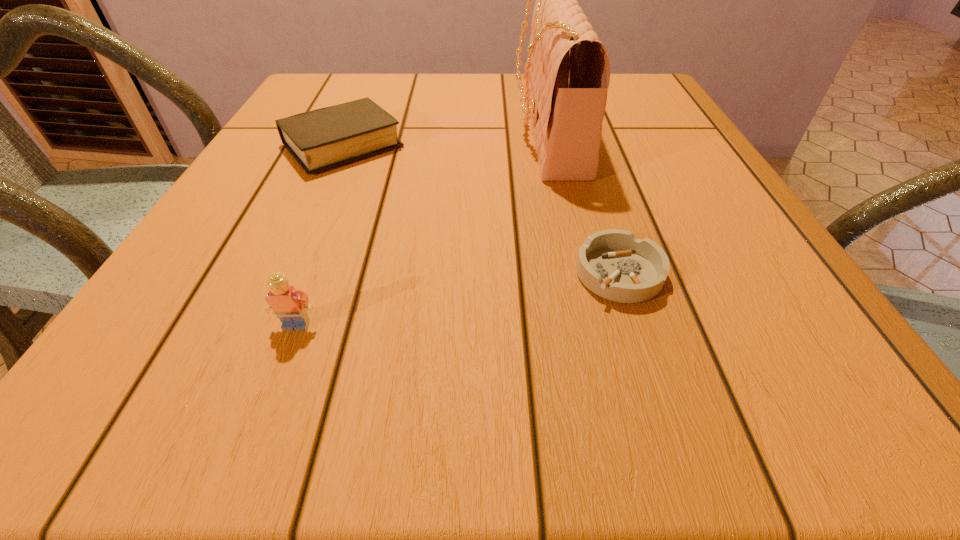
Locate which object is the second closest to the Bible. Please provide its 2D coordinates. Your answer should be formatted as a tuple, i.e. [(x, y)], where the tuple contains the x and y coordinates of a point satisfying the conditions above.

[(290, 305)]

Identify the location of free space that satisfies the following two spatial constraints: 1. on the front-facing side of the handbag; 2. on the front-facing side of the nearest object. (590, 325).

The image size is (960, 540). In order to click on vacant area that satisfies the following two spatial constraints: 1. on the front-facing side of the tallest object; 2. on the front-facing side of the Lego in this screenshot , I will do `click(590, 325)`.

Locate an element on the screen. The height and width of the screenshot is (540, 960). vacant space that satisfies the following two spatial constraints: 1. on the front-facing side of the tallest object; 2. on the back side of the shortest object is located at coordinates (579, 273).

Find the location of a particular element. free space that satisfies the following two spatial constraints: 1. on the front-facing side of the second nearest object; 2. on the right side of the handbag is located at coordinates (579, 273).

Locate an element on the screen. The image size is (960, 540). free space that satisfies the following two spatial constraints: 1. on the front-facing side of the tallest object; 2. on the front-facing side of the Lego is located at coordinates (590, 325).

At what (x,y) coordinates should I click in order to perform the action: click on vacant space that satisfies the following two spatial constraints: 1. on the front-facing side of the tallest object; 2. on the front-facing side of the second tallest object. Please return your answer as a coordinate pair (x, y). Looking at the image, I should click on (590, 325).

Where is `blank area in the image that satisfies the following two spatial constraints: 1. on the front-facing side of the ashtray; 2. on the left side of the handbag`? Image resolution: width=960 pixels, height=540 pixels. blank area in the image that satisfies the following two spatial constraints: 1. on the front-facing side of the ashtray; 2. on the left side of the handbag is located at coordinates [579, 273].

The height and width of the screenshot is (540, 960). Find the location of `free space that satisfies the following two spatial constraints: 1. on the front side of the third tallest object; 2. on the left side of the ashtray`. free space that satisfies the following two spatial constraints: 1. on the front side of the third tallest object; 2. on the left side of the ashtray is located at coordinates (287, 273).